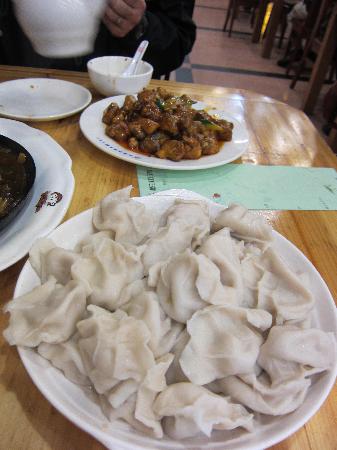
Identify the location of plate. (290, 423).